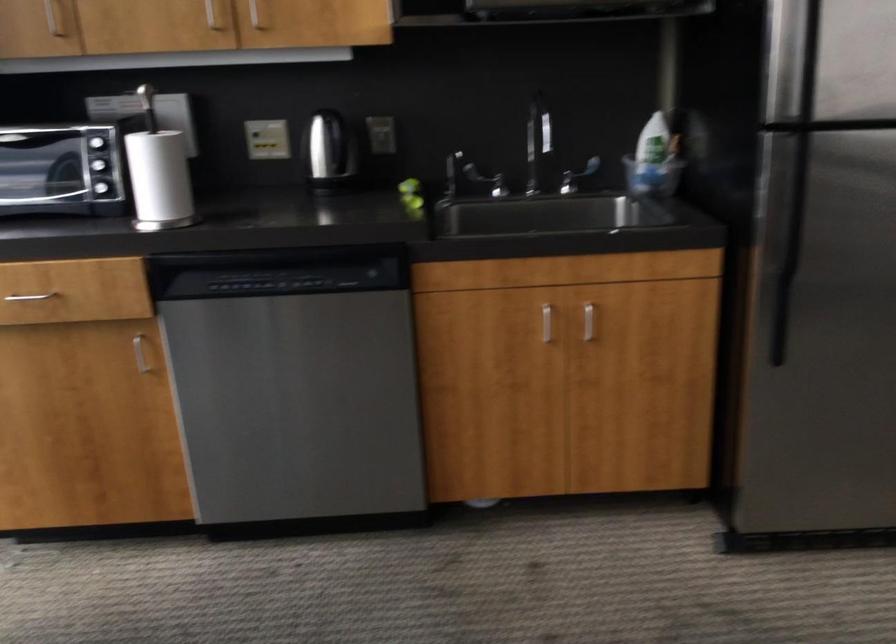
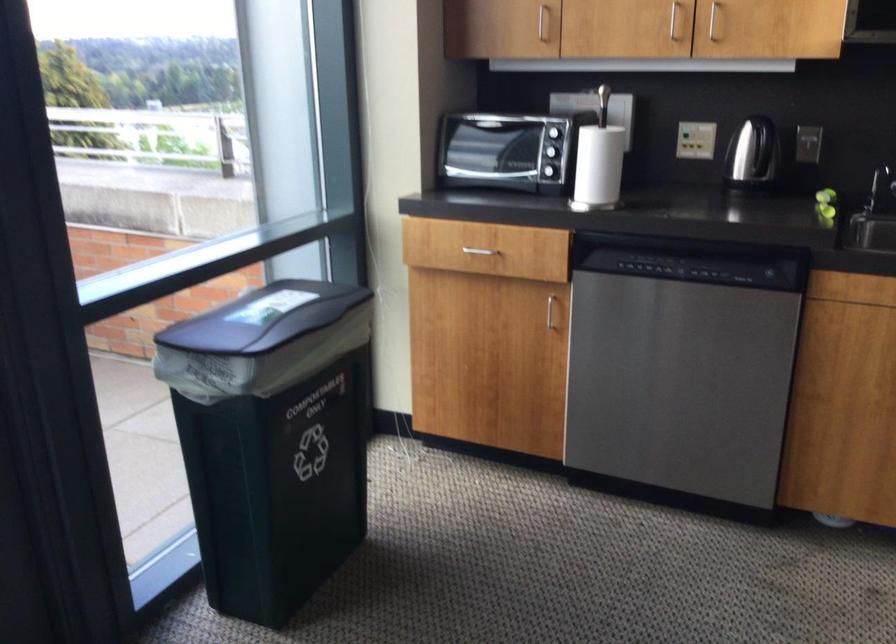
Locate, in the second image, the point that corresponds to point (143, 355) in the first image.

(549, 310)